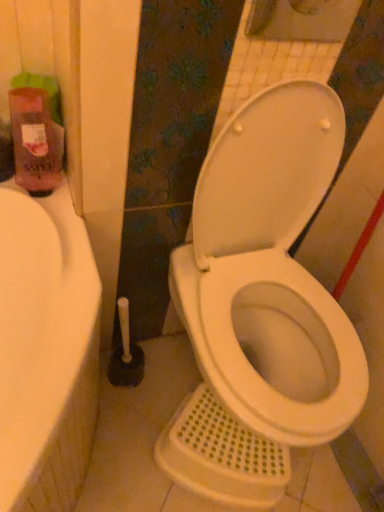
Question: Is white glossy toilet at center positioned with its back to pink matte bottle at left?

Choices:
 (A) no
 (B) yes

Answer: (A)

Question: Would you say pink matte bottle at left is part of white glossy toilet at center's contents?

Choices:
 (A) no
 (B) yes

Answer: (A)

Question: From a real-world perspective, is white glossy toilet at center located beneath pink matte bottle at left?

Choices:
 (A) no
 (B) yes

Answer: (B)

Question: Considering the relative sizes of white glossy toilet at center and pink matte bottle at left in the image provided, is white glossy toilet at center wider than pink matte bottle at left?

Choices:
 (A) yes
 (B) no

Answer: (A)

Question: Considering the relative positions of white glossy toilet at center and pink matte bottle at left in the image provided, is white glossy toilet at center to the right of pink matte bottle at left from the viewer's perspective?

Choices:
 (A) no
 (B) yes

Answer: (B)

Question: Can you confirm if white glossy toilet at center is bigger than pink matte bottle at left?

Choices:
 (A) yes
 (B) no

Answer: (A)

Question: Does pink matte bottle at left have a larger size compared to white glossy toilet at center?

Choices:
 (A) no
 (B) yes

Answer: (A)

Question: From the image's perspective, is pink matte bottle at left on top of white glossy toilet at center?

Choices:
 (A) no
 (B) yes

Answer: (B)

Question: Is pink matte bottle at left looking in the opposite direction of white glossy toilet at center?

Choices:
 (A) no
 (B) yes

Answer: (A)

Question: Does pink matte bottle at left have a smaller size compared to white glossy toilet at center?

Choices:
 (A) no
 (B) yes

Answer: (B)

Question: Is pink matte bottle at left taller than white glossy toilet at center?

Choices:
 (A) yes
 (B) no

Answer: (B)

Question: Is pink matte bottle at left to the right of white glossy toilet at center from the viewer's perspective?

Choices:
 (A) no
 (B) yes

Answer: (A)

Question: Relative to white glossy toilet at center, is pink matte bottle at left in front or behind?

Choices:
 (A) front
 (B) behind

Answer: (B)